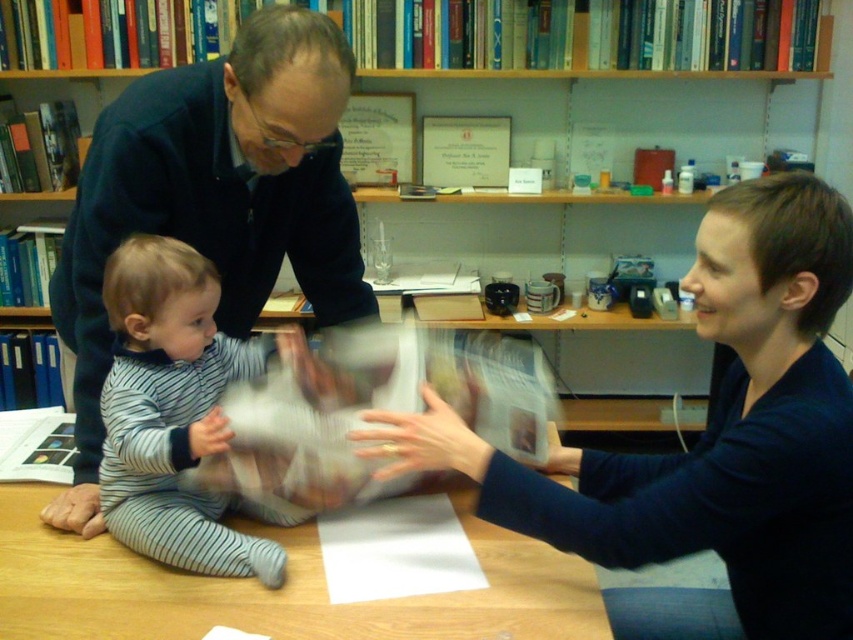
You are an architect designing a new library and want to place two important markers at the coordinates point (606,72) and point (157,484). According to the scene, which point is located behind the other?

Point (606,72) is behind point (157,484).

You are a visitor in the library and want to take a photo of the striped cotton onesie at center without moving any objects. Since the wooden table at center is blocking your view, where should you position yourself to capture the onesie clearly?

The wooden table at center is in front of the striped cotton onesie at center, so you should move behind the wooden table at center to get a clear view of the striped cotton onesie at center.

You are standing in the library and see two points marked in the scene. The first point is at coordinates point [404,602] and the second is at point [170,477]. Which point is closer to you?

Point [404,602] is in front of point [170,477], so the first point is closer to you.